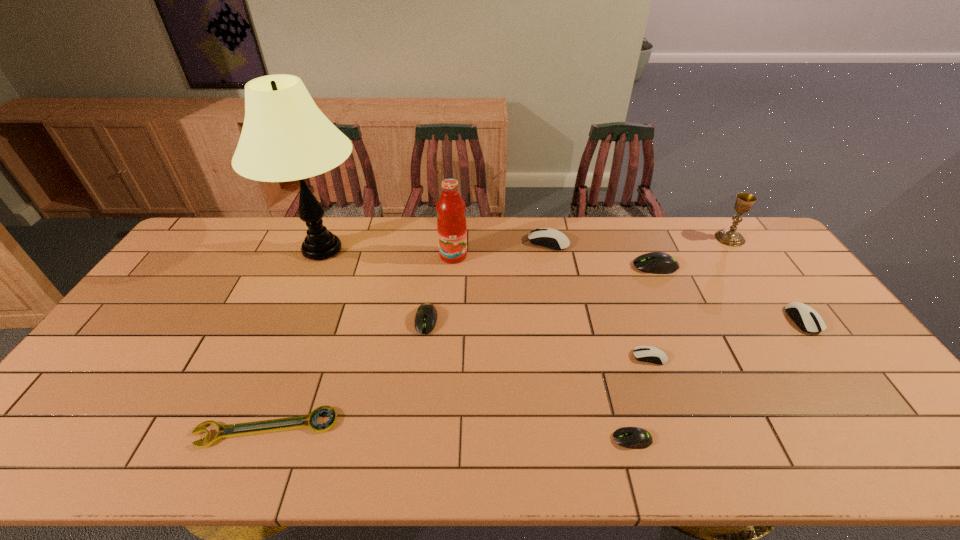
In order to click on object that is at the far right corner in this screenshot , I will do `click(744, 201)`.

Identify the location of free space at the far edge. This screenshot has width=960, height=540. (380, 217).

At what (x,y) coordinates should I click in order to perform the action: click on vacant space at the near edge of the desktop. Please return your answer as a coordinate pair (x, y). Looking at the image, I should click on (648, 464).

Where is `free space at the left edge`? free space at the left edge is located at coordinates (189, 307).

Where is `free location at the far left corner`? free location at the far left corner is located at coordinates (199, 255).

Where is `free region at the far right corner of the desktop`? Image resolution: width=960 pixels, height=540 pixels. free region at the far right corner of the desktop is located at coordinates (743, 223).

Where is `empty space that is in between the wrench and the leftmost white mouse`? The height and width of the screenshot is (540, 960). empty space that is in between the wrench and the leftmost white mouse is located at coordinates (407, 335).

The height and width of the screenshot is (540, 960). Find the location of `free spot between the fifth computer mouse from left to right and the second biggest gray computer mouse`. free spot between the fifth computer mouse from left to right and the second biggest gray computer mouse is located at coordinates (540, 293).

At what (x,y) coordinates should I click in order to perform the action: click on free space that is in between the farthest white mouse and the black lamp. Please return your answer as a coordinate pair (x, y). This screenshot has height=540, width=960. Looking at the image, I should click on (435, 246).

Image resolution: width=960 pixels, height=540 pixels. Identify the location of free space that is in between the rightmost computer mouse and the gold chalice. (766, 279).